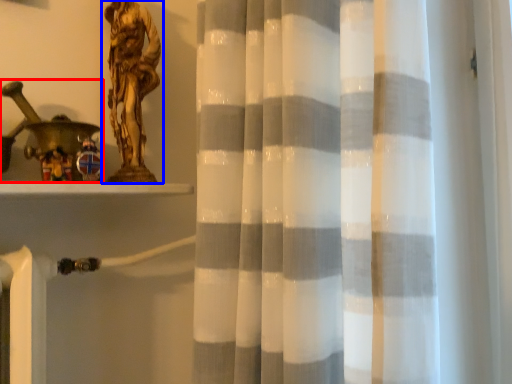
Question: Which point is closer to the camera, toy (highlighted by a red box) or sculpture (highlighted by a blue box)?

Choices:
 (A) toy
 (B) sculpture

Answer: (A)